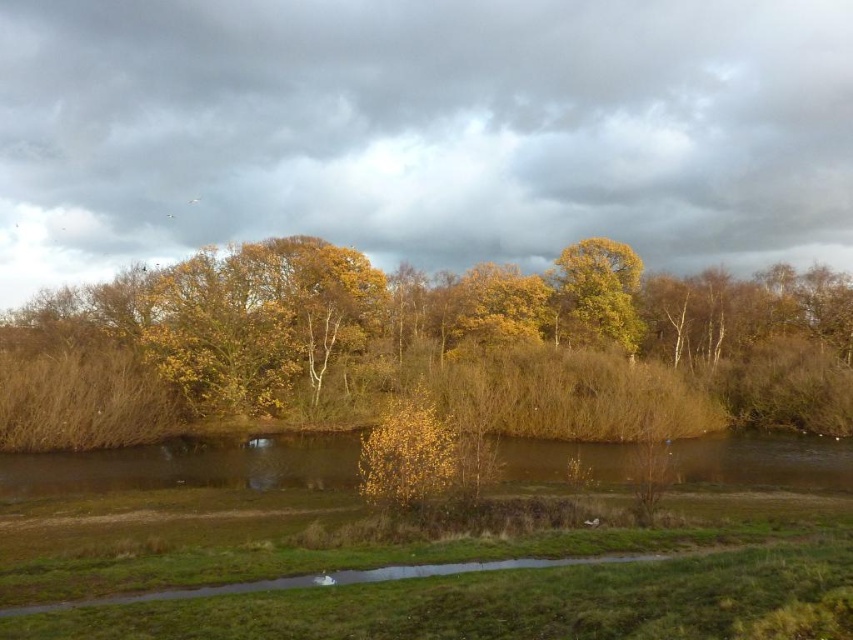
Question: Which point appears farthest from the camera in this image?

Choices:
 (A) (601, 268)
 (B) (103, 397)

Answer: (A)

Question: Does yellow leafy tree at center have a smaller size compared to yellow leafy tree at upper center?

Choices:
 (A) yes
 (B) no

Answer: (B)

Question: Does yellow leafy tree at center come behind yellow leafy tree at upper center?

Choices:
 (A) yes
 (B) no

Answer: (B)

Question: Is yellow leafy tree at center to the left of yellow leafy tree at upper center from the viewer's perspective?

Choices:
 (A) yes
 (B) no

Answer: (A)

Question: Which point appears closest to the camera in this image?

Choices:
 (A) (454, 348)
 (B) (635, 317)

Answer: (A)

Question: Among these objects, which one is nearest to the camera?

Choices:
 (A) yellow leafy tree at center
 (B) yellow leafy tree at upper center

Answer: (A)